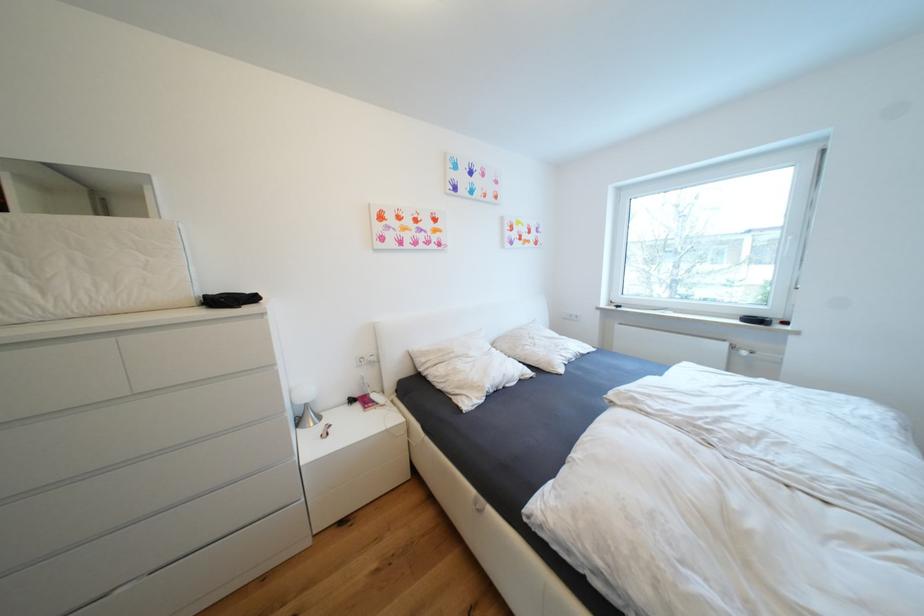
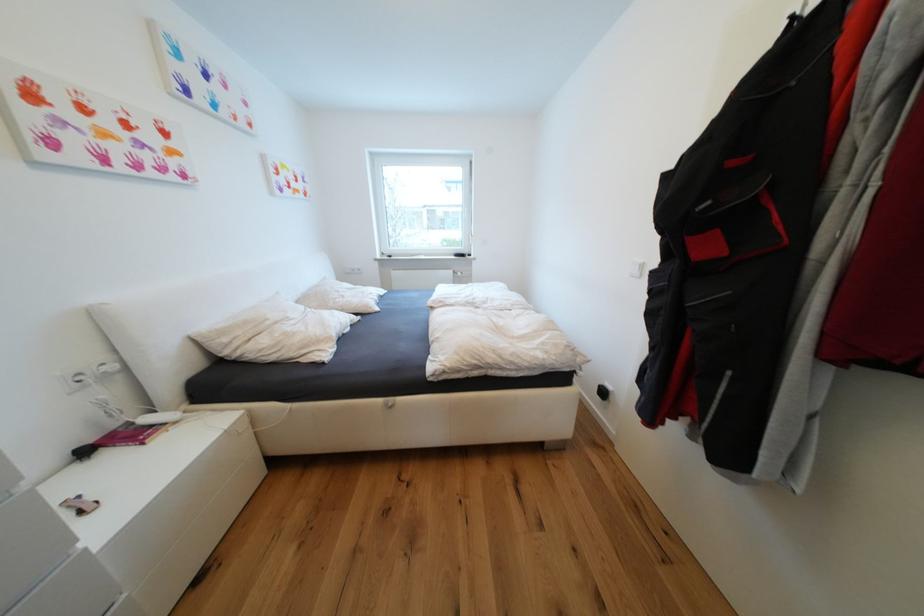
The point at (541, 346) is marked in the first image. Where is the corresponding point in the second image?

(349, 297)